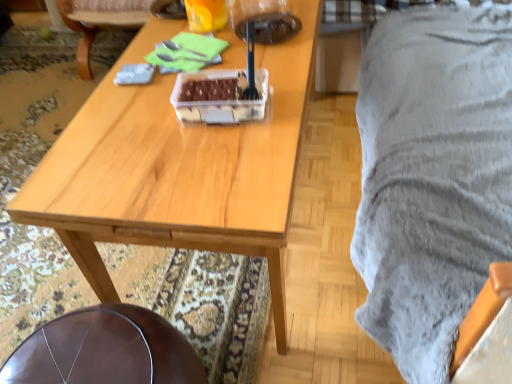
Question: Considering the relative sizes of wooden table at center and translucent plastic cup at upper center in the image provided, is wooden table at center taller than translucent plastic cup at upper center?

Choices:
 (A) no
 (B) yes

Answer: (B)

Question: Is wooden table at center oriented towards translucent plastic cup at upper center?

Choices:
 (A) yes
 (B) no

Answer: (B)

Question: Would you say wooden table at center is a long distance from translucent plastic cup at upper center?

Choices:
 (A) no
 (B) yes

Answer: (A)

Question: Is wooden table at center completely or partially outside of translucent plastic cup at upper center?

Choices:
 (A) yes
 (B) no

Answer: (A)

Question: From the image's perspective, is wooden table at center located beneath translucent plastic cup at upper center?

Choices:
 (A) yes
 (B) no

Answer: (A)

Question: Can you confirm if wooden table at center is shorter than translucent plastic cup at upper center?

Choices:
 (A) no
 (B) yes

Answer: (A)

Question: Is leather seat at lower left, which is the first chair from front to back, thinner than translucent plastic container at center?

Choices:
 (A) yes
 (B) no

Answer: (B)

Question: Would you say leather seat at lower left, which is the first chair from front to back, is outside translucent plastic container at center?

Choices:
 (A) yes
 (B) no

Answer: (A)

Question: From a real-world perspective, is leather seat at lower left, the first chair positioned from the bottom, located higher than translucent plastic container at center?

Choices:
 (A) no
 (B) yes

Answer: (A)

Question: Considering the relative positions of leather seat at lower left, which appears as the second chair when viewed from the top, and translucent plastic container at center in the image provided, is leather seat at lower left, which appears as the second chair when viewed from the top, to the left of translucent plastic container at center from the viewer's perspective?

Choices:
 (A) yes
 (B) no

Answer: (A)

Question: Is leather seat at lower left, which is the first chair from front to back, facing away from translucent plastic container at center?

Choices:
 (A) yes
 (B) no

Answer: (B)

Question: From the image's perspective, does leather seat at lower left, which appears as the second chair when viewed from the top, appear higher than translucent plastic container at center?

Choices:
 (A) yes
 (B) no

Answer: (B)

Question: Is leather seat at lower left, the first chair positioned from the bottom, directly adjacent to brown leather chair at center, the first chair from the top?

Choices:
 (A) no
 (B) yes

Answer: (A)